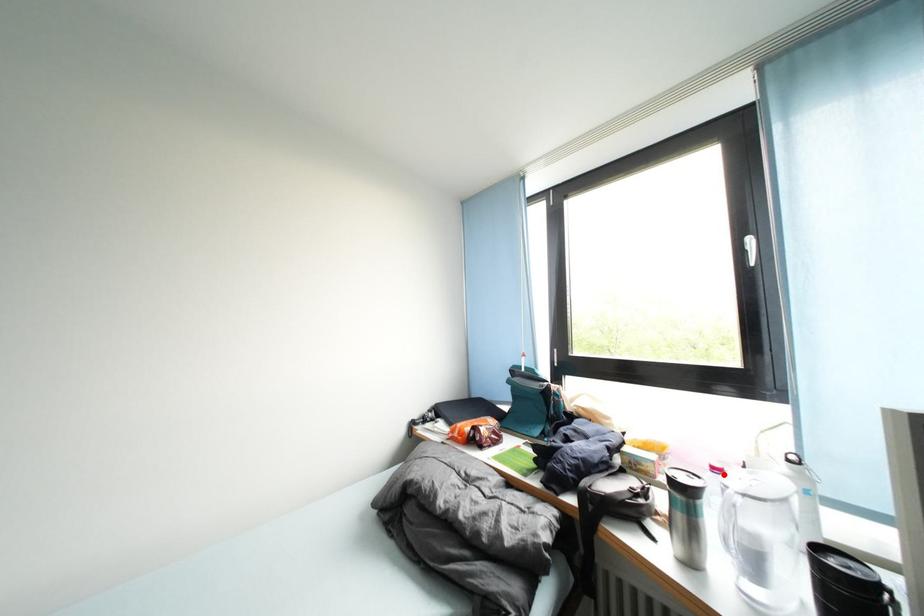
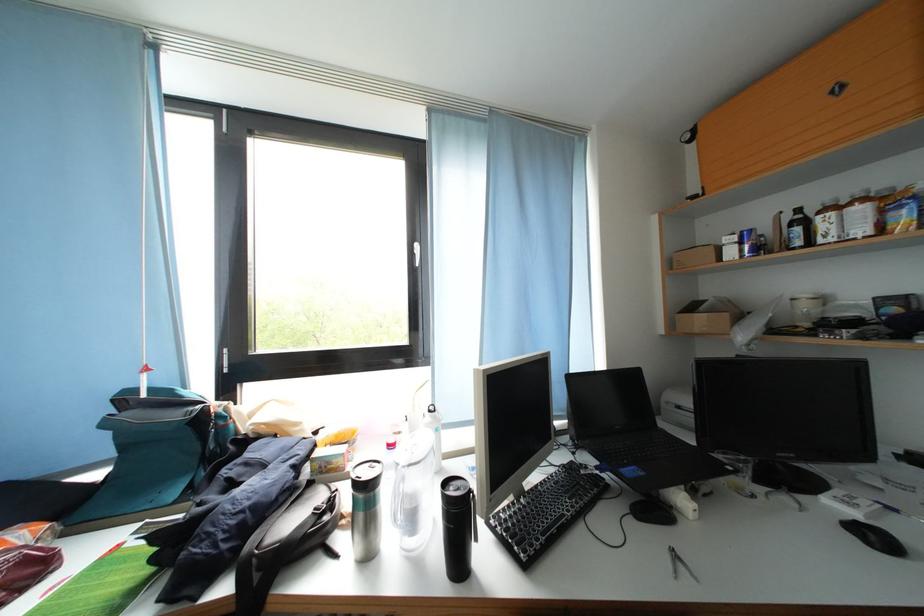
Question: I am providing you with two images of the same scene from different viewpoints. A red point is marked on the first image. Can you still see the location of the red point in image 2?

Choices:
 (A) Yes
 (B) No

Answer: (A)